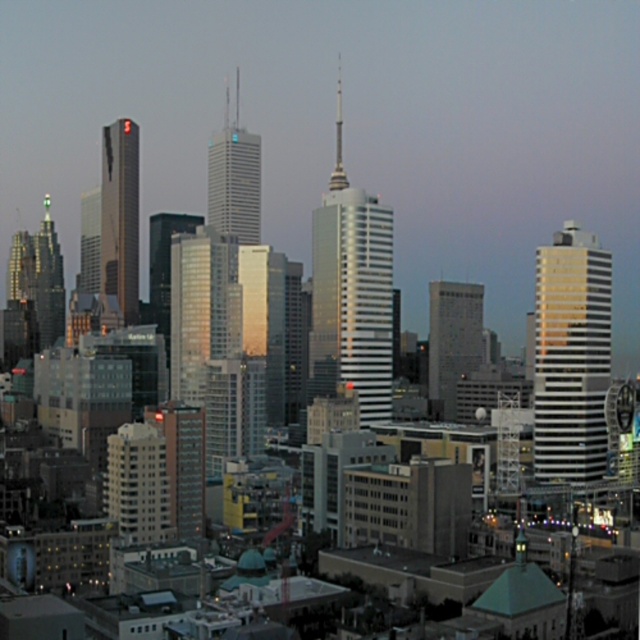
Can you confirm if reflective glass skyscraper at center is positioned above shiny silver spire at center-left?

Result: Actually, reflective glass skyscraper at center is below shiny silver spire at center-left.

Is reflective glass skyscraper at center further to camera compared to shiny silver spire at center-left?

That is False.

Is point (444, 355) in front of point (51, 228)?

Yes, point (444, 355) is in front of point (51, 228).

Identify the location of reflective glass skyscraper at center. (452, 339).

Is white glossy building at right behind reflective glass skyscraper at center?

No, it is in front of reflective glass skyscraper at center.

Find the location of a particular element. This screenshot has width=640, height=640. white glossy building at right is located at coordinates (572, 355).

Between point (556, 449) and point (38, 316), which one is positioned in front?

Positioned in front is point (556, 449).

The width and height of the screenshot is (640, 640). In order to click on white glossy building at right in this screenshot , I will do `click(572, 355)`.